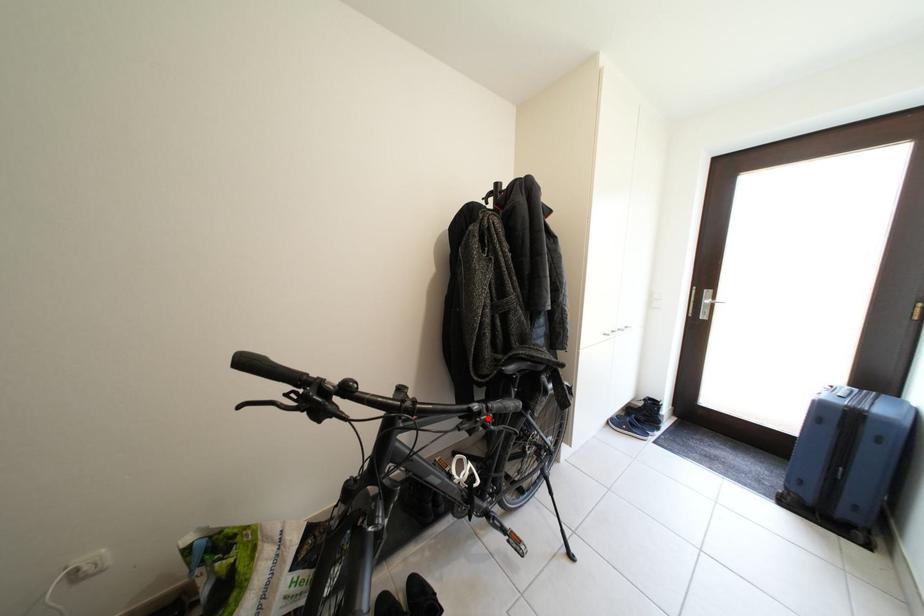
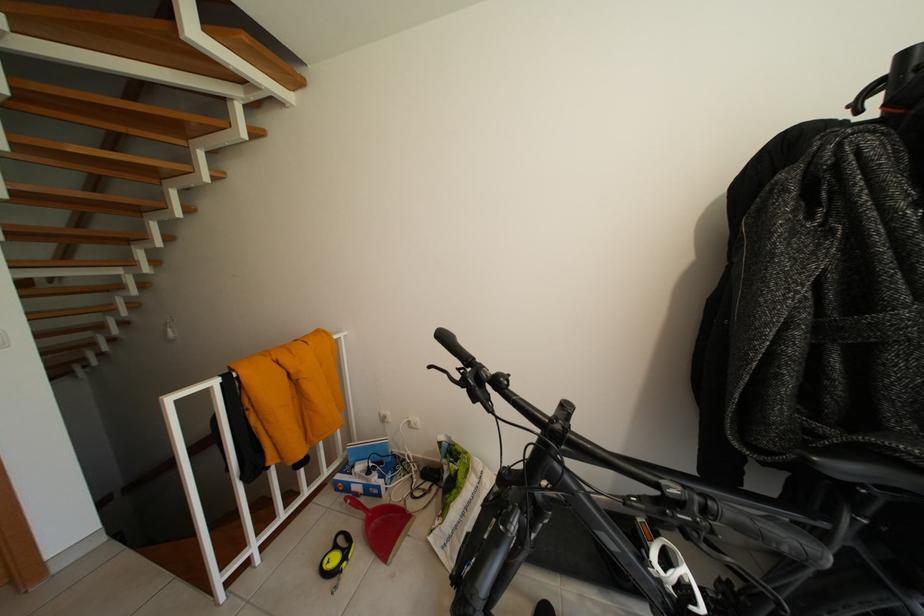
Question: I am providing you with two images of the same scene from different viewpoints. Image1 has a red point marked. In image2, the corresponding 3D location appears at what relative position? Reply with the corresponding letter.

Choices:
 (A) Closer
 (B) Farther

Answer: (B)